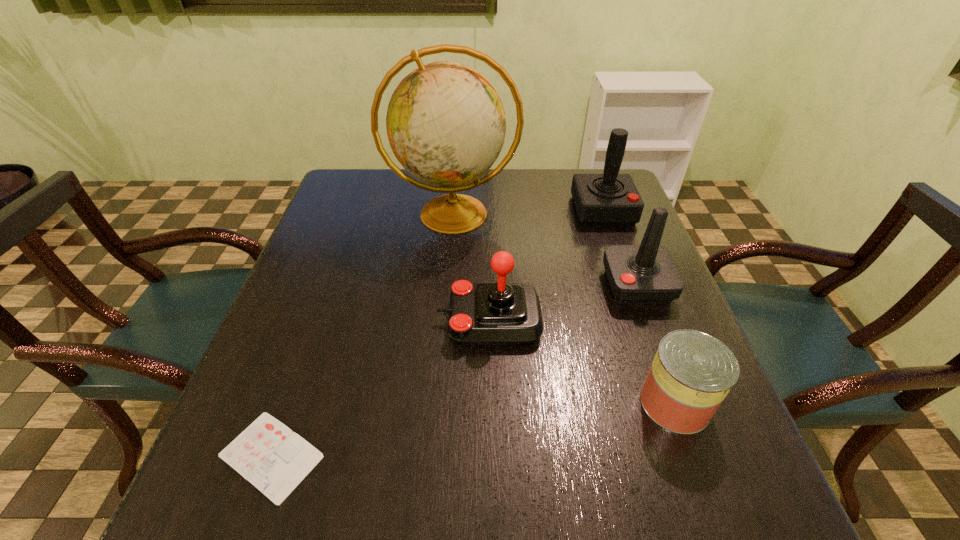
Identify the location of globe. Image resolution: width=960 pixels, height=540 pixels. (446, 125).

You are a GUI agent. You are given a task and a screenshot of the screen. Output one action in this format:
    pyautogui.click(x=<x>, y=<y>)
    Task: Click on the farthest joystick
    The height and width of the screenshot is (540, 960).
    Given the screenshot: What is the action you would take?
    pyautogui.click(x=610, y=198)

Locate an element on the screen. This screenshot has width=960, height=540. the leftmost joystick is located at coordinates (500, 313).

Locate an element on the screen. The width and height of the screenshot is (960, 540). can is located at coordinates (692, 372).

Locate an element on the screen. The height and width of the screenshot is (540, 960). diary is located at coordinates (268, 454).

The height and width of the screenshot is (540, 960). Identify the location of vacant area situated on the right of the globe. (547, 214).

Find the location of a particular element. This screenshot has width=960, height=540. blank space located 0.370m on the base of the farthest joystick is located at coordinates (647, 334).

Locate an element on the screen. This screenshot has height=540, width=960. free space located 0.120m on the base of the leftmost joystick is located at coordinates click(x=382, y=320).

This screenshot has height=540, width=960. Identify the location of vacant space situated 0.130m on the base of the leftmost joystick. (377, 320).

Find the location of a particular element. The image size is (960, 540). blank space located 0.220m on the base of the leftmost joystick is located at coordinates (335, 320).